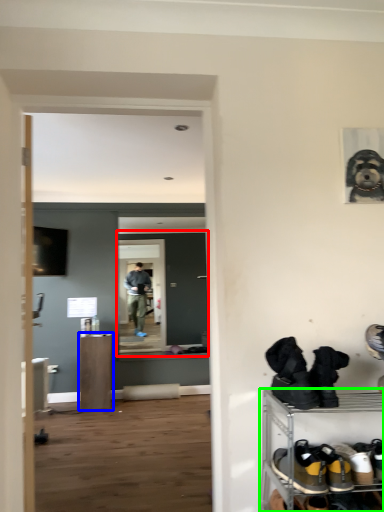
Question: Estimate the real-world distances between objects in this image. Which object is farther from glass door (highlighted by a red box), furniture (highlighted by a blue box) or shelf (highlighted by a green box)?

Choices:
 (A) furniture
 (B) shelf

Answer: (B)